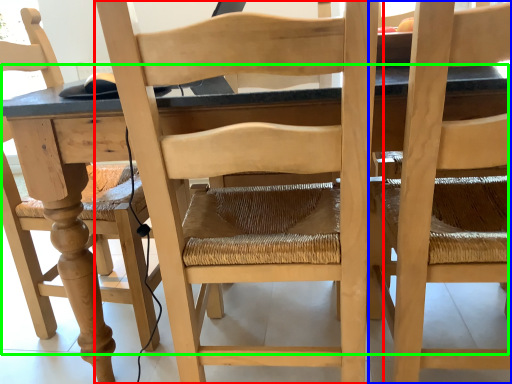
Question: Which object is the farthest from chair (highlighted by a red box)? Choose among these: chair (highlighted by a blue box) or table (highlighted by a green box).

Choices:
 (A) chair
 (B) table

Answer: (A)